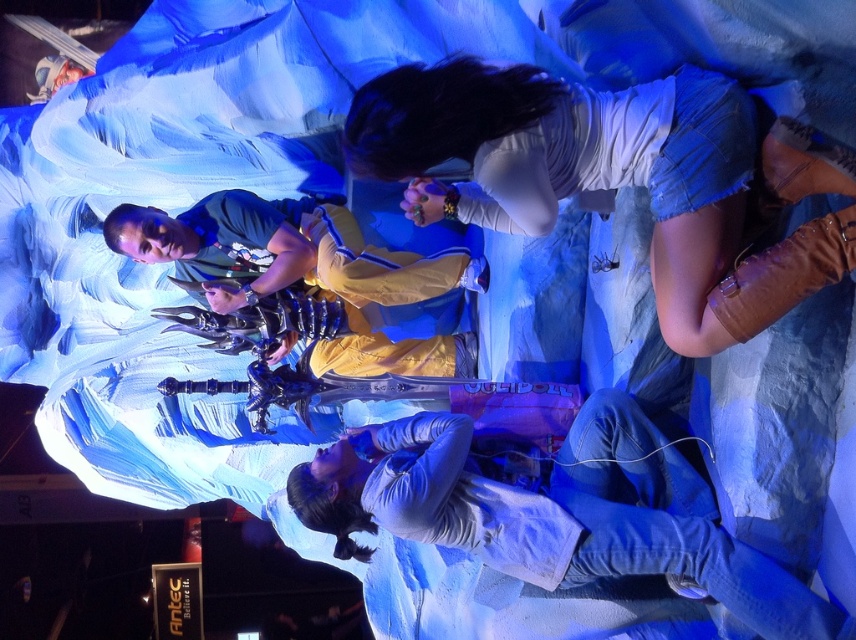
Does white matte shirt at lower center lie in front of matte yellow jacket at center?

Yes, it is in front of matte yellow jacket at center.

Does white matte shirt at lower center appear on the left side of matte yellow jacket at center?

Incorrect, white matte shirt at lower center is not on the left side of matte yellow jacket at center.

The image size is (856, 640). Identify the location of white matte shirt at lower center. (554, 513).

Between denim shorts at upper right and matte yellow jacket at center, which one has more height?

denim shorts at upper right

Can you confirm if denim shorts at upper right is smaller than matte yellow jacket at center?

No.

Is point (691, 288) behind point (141, 221)?

That is False.

Where is `denim shorts at upper right`? The height and width of the screenshot is (640, 856). denim shorts at upper right is located at coordinates (620, 177).

Does denim shorts at upper right appear under white matte shirt at lower center?

Actually, denim shorts at upper right is above white matte shirt at lower center.

Does denim shorts at upper right come behind white matte shirt at lower center?

No, denim shorts at upper right is in front of white matte shirt at lower center.

I want to click on denim shorts at upper right, so click(620, 177).